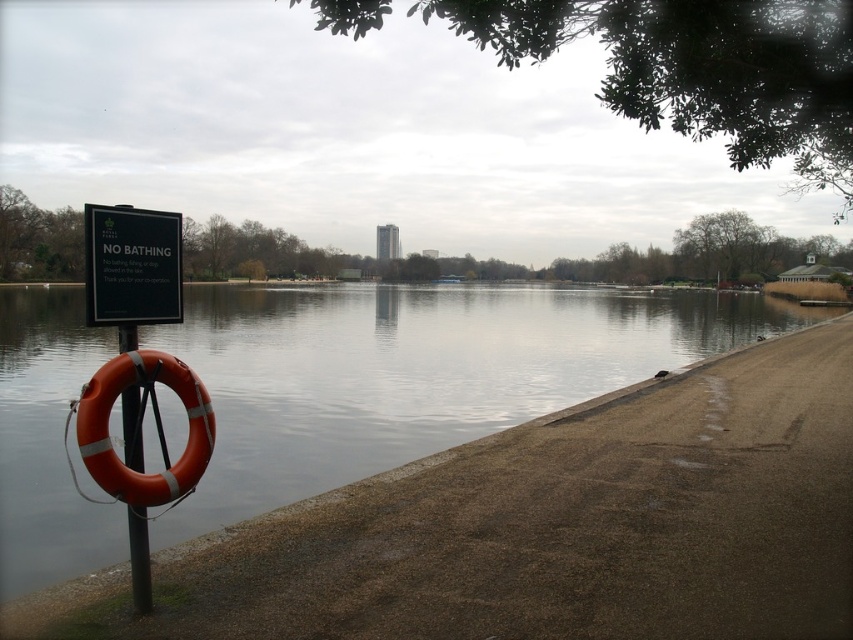
Question: Based on their relative distances, which object is nearer to the black plastic sign at left?

Choices:
 (A) smooth concrete river at lower left
 (B) orange rubber ring at left
 (C) orange rubber life jacket at left

Answer: (C)

Question: Where is smooth concrete river at lower left located in relation to black plastic sign at left in the image?

Choices:
 (A) left
 (B) right

Answer: (A)

Question: Does orange rubber life jacket at left have a smaller size compared to black plastic sign at left?

Choices:
 (A) no
 (B) yes

Answer: (A)

Question: Does smooth concrete river at lower left come behind black plastic sign at left?

Choices:
 (A) no
 (B) yes

Answer: (B)

Question: Which object is the farthest from the smooth concrete river at lower left?

Choices:
 (A) black plastic sign at left
 (B) orange rubber life jacket at left

Answer: (A)

Question: Which object appears farthest from the camera in this image?

Choices:
 (A) orange rubber ring at left
 (B) smooth concrete river at lower left

Answer: (B)